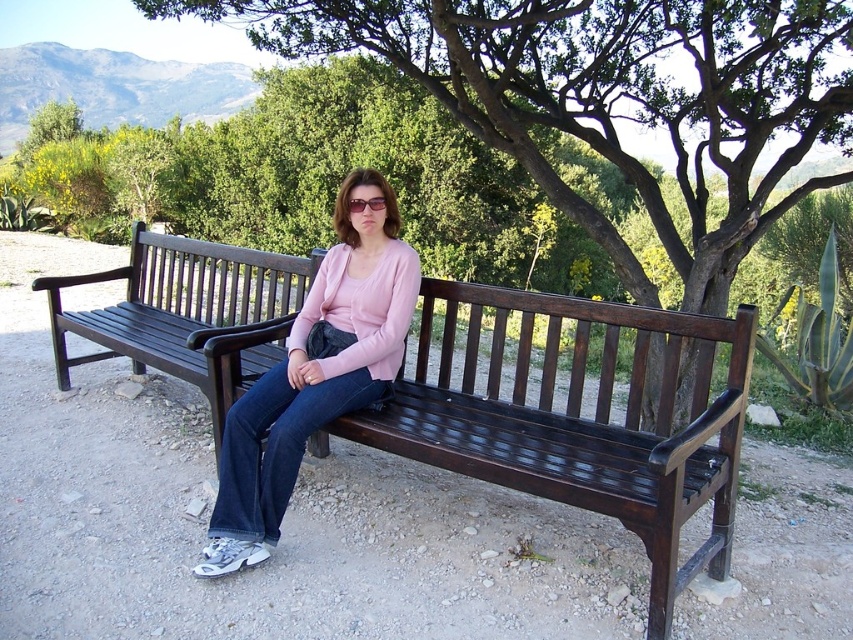
Measure the distance between dark brown wood bench at center and matte black sunglasses at center.

dark brown wood bench at center and matte black sunglasses at center are 4.31 feet apart.

Does dark brown wood bench at center have a larger size compared to matte black sunglasses at center?

Yes.

The image size is (853, 640). What do you see at coordinates (576, 420) in the screenshot?
I see `dark brown wood bench at center` at bounding box center [576, 420].

Find the location of a particular element. Image resolution: width=853 pixels, height=640 pixels. dark brown wood bench at center is located at coordinates (576, 420).

Between matte pink sweater at center and matte black sunglasses at center, which one appears on the right side from the viewer's perspective?

From the viewer's perspective, matte black sunglasses at center appears more on the right side.

Can you confirm if matte pink sweater at center is positioned to the right of matte black sunglasses at center?

In fact, matte pink sweater at center is to the left of matte black sunglasses at center.

Who is more forward, (341,252) or (357,205)?

Point (357,205) is in front.

Locate an element on the screen. matte pink sweater at center is located at coordinates (314, 374).

Which of these two, dark brown wood bench at center or matte pink sweater at center, stands taller?

With more height is matte pink sweater at center.

Is dark brown wood bench at center wider than matte pink sweater at center?

Yes, dark brown wood bench at center is wider than matte pink sweater at center.

Locate an element on the screen. Image resolution: width=853 pixels, height=640 pixels. dark brown wood bench at center is located at coordinates (576, 420).